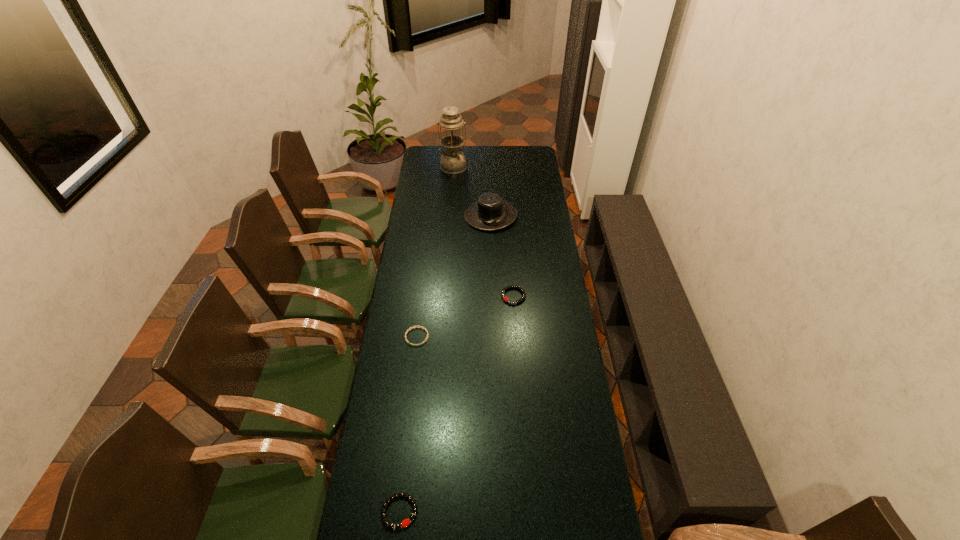
Locate an element on the screen. blank area located 0.130m on the back of the dress hat is located at coordinates (490, 186).

At what (x,y) coordinates should I click in order to perform the action: click on vacant space located 0.080m on the front of the farthest bracelet. Please return your answer as a coordinate pair (x, y). Image resolution: width=960 pixels, height=540 pixels. Looking at the image, I should click on [516, 321].

The width and height of the screenshot is (960, 540). I want to click on free space located on the right of the nearest bracelet, so click(552, 511).

Locate an element on the screen. This screenshot has width=960, height=540. vacant space located on the surface of the shortest object showing star-shaped elements is located at coordinates (411, 384).

Where is `object that is positioned at the far edge`? Image resolution: width=960 pixels, height=540 pixels. object that is positioned at the far edge is located at coordinates (453, 161).

Locate an element on the screen. oil lamp present at the left edge is located at coordinates (453, 161).

Find the location of a particular element. object that is at the far left corner is located at coordinates (453, 161).

Locate an element on the screen. vacant area at the far edge is located at coordinates (477, 166).

Locate an element on the screen. vacant space at the left edge is located at coordinates (399, 315).

Locate an element on the screen. This screenshot has height=540, width=960. vacant space at the right edge of the desktop is located at coordinates (558, 255).